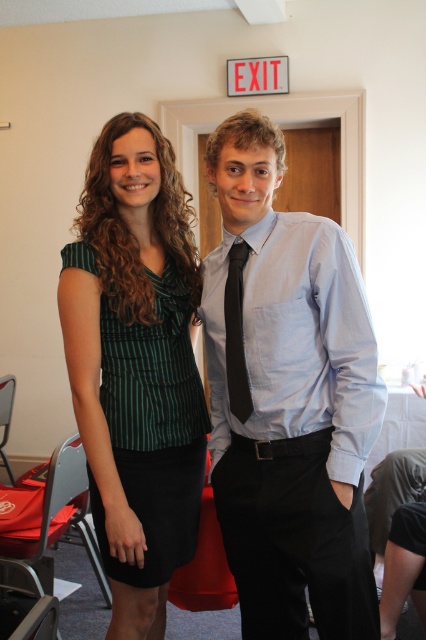
Is light blue shirt at center taller than black silk tie at center?

Yes.

This screenshot has width=426, height=640. Describe the element at coordinates (287, 397) in the screenshot. I see `light blue shirt at center` at that location.

Does point (255, 593) come closer to viewer compared to point (238, 394)?

No.

Image resolution: width=426 pixels, height=640 pixels. Identify the location of light blue shirt at center. (287, 397).

Where is `green striped blouse at center`? green striped blouse at center is located at coordinates pyautogui.click(x=135, y=365).

Does point (299, 614) come behind point (135, 632)?

Yes, point (299, 614) is behind point (135, 632).

Is the position of light blue shirt at center more distant than that of green striped blouse at center?

That is False.

Is point (213, 177) farther from viewer compared to point (186, 531)?

No.

Where is `light blue shirt at center`? Image resolution: width=426 pixels, height=640 pixels. light blue shirt at center is located at coordinates (287, 397).